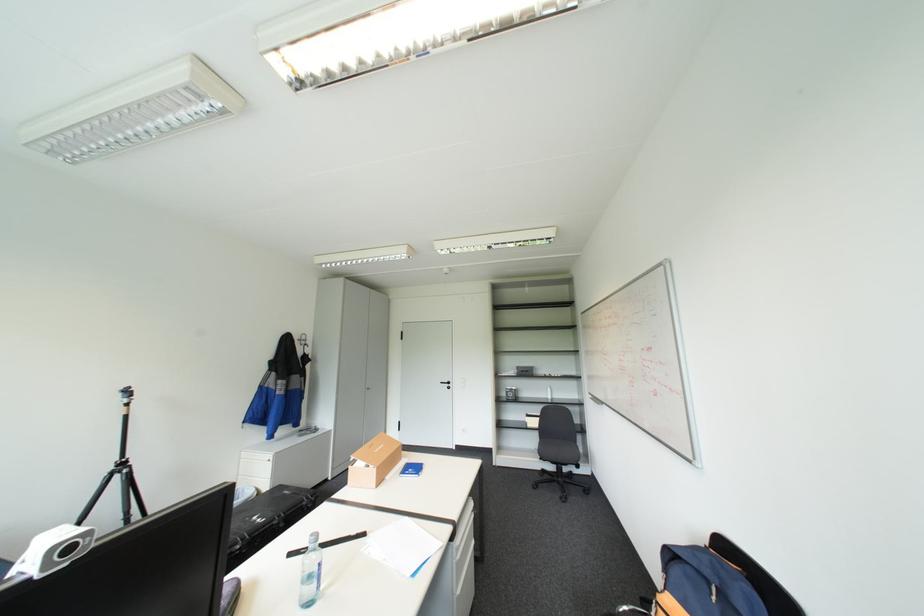
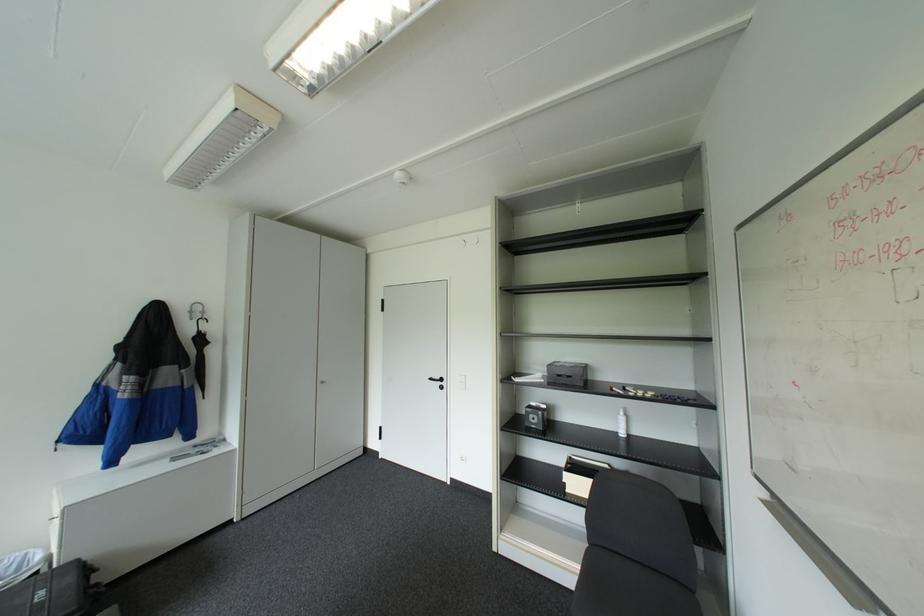
Locate, in the second image, the point that corresponds to [310,342] in the first image.

(200, 318)